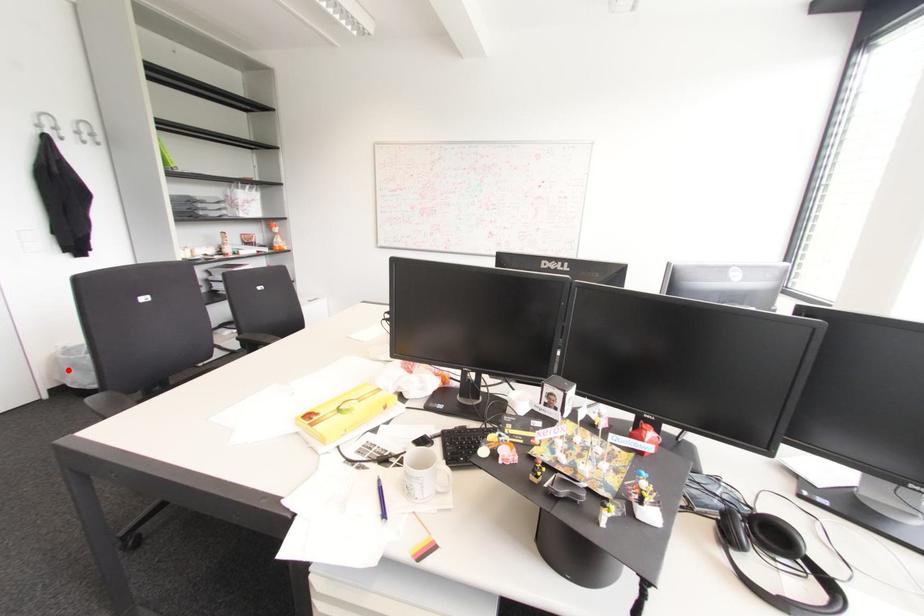
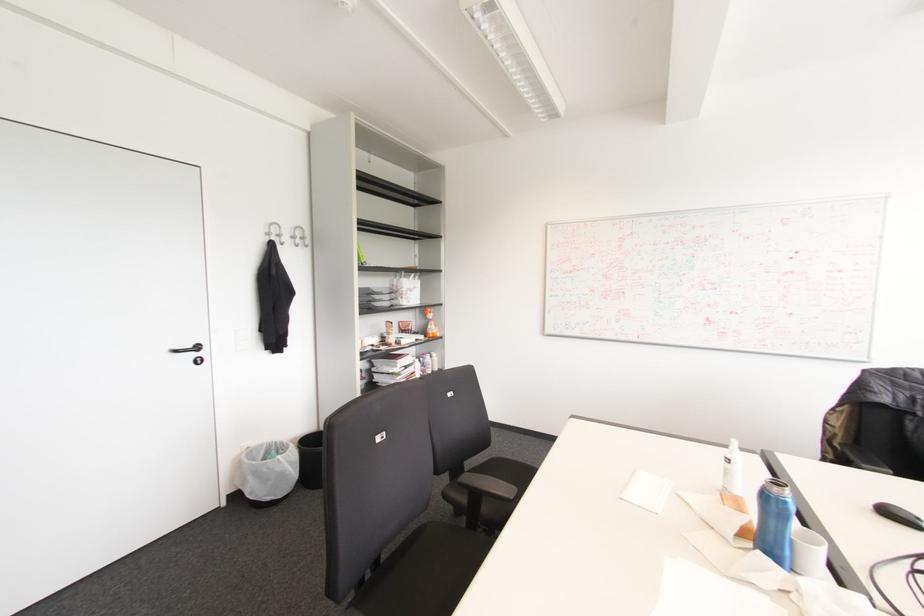
Question: I am providing you with two images of the same scene from different viewpoints. In image1, a red point is highlighted. Considering the same 3D point in image2, which of the following is correct?

Choices:
 (A) It is closer
 (B) It is farther

Answer: (B)